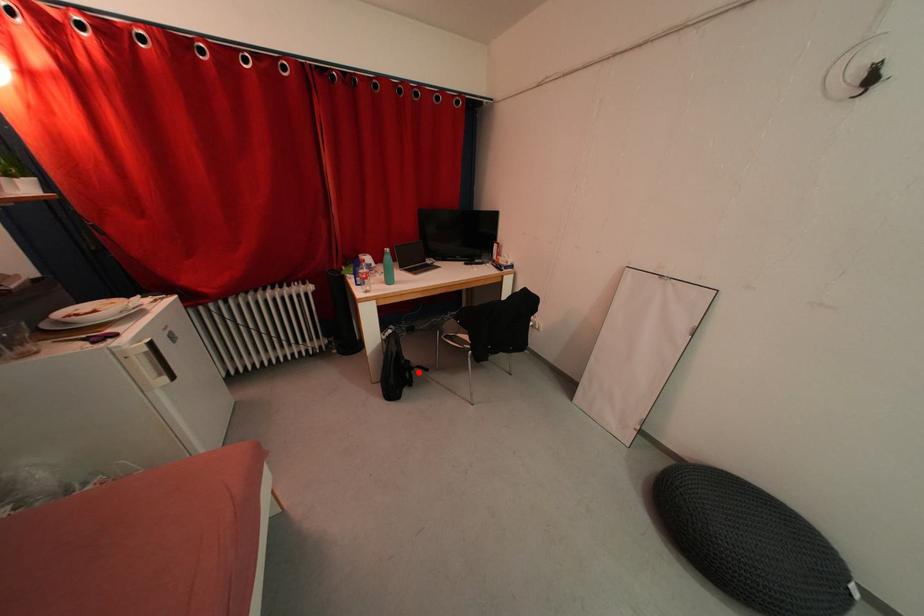
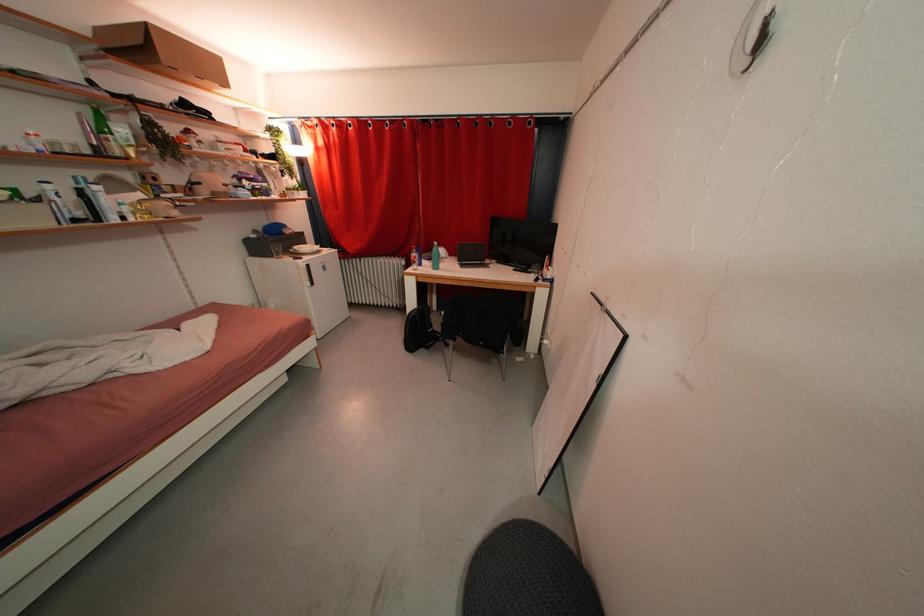
Question: I am providing you with two images of the same scene from different viewpoints. In image1, a red point is highlighted. Considering the same 3D point in image2, which of the following is correct?

Choices:
 (A) It is closer
 (B) It is farther

Answer: (B)